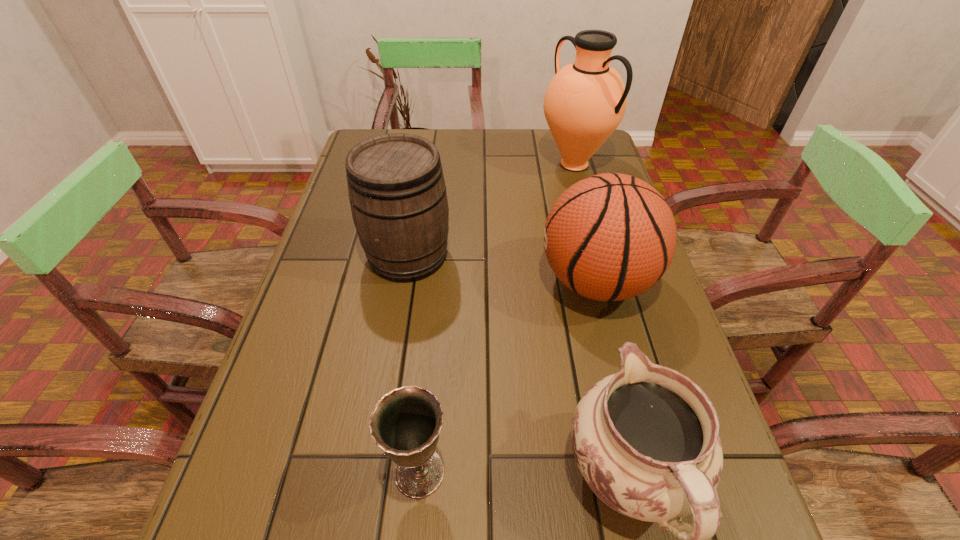
Where is `vacant area situated 0.160m on the back of the chalice`? The width and height of the screenshot is (960, 540). vacant area situated 0.160m on the back of the chalice is located at coordinates (430, 361).

I want to click on object present at the far edge, so click(x=584, y=103).

Locate an element on the screen. Image resolution: width=960 pixels, height=540 pixels. object that is at the left edge is located at coordinates (396, 187).

The image size is (960, 540). I want to click on pitcher that is positioned at the right edge, so click(584, 103).

Where is `basketball present at the right edge`? basketball present at the right edge is located at coordinates (609, 237).

Image resolution: width=960 pixels, height=540 pixels. I want to click on object situated at the far right corner, so click(x=584, y=103).

Image resolution: width=960 pixels, height=540 pixels. In the image, there is a desktop. Find the location of `vacant region at the far edge`. vacant region at the far edge is located at coordinates (511, 145).

This screenshot has width=960, height=540. In the image, there is a desktop. Identify the location of free space at the left edge. tap(333, 289).

Image resolution: width=960 pixels, height=540 pixels. I want to click on free space at the right edge, so click(590, 307).

The image size is (960, 540). Identify the location of free point at the far right corner. (602, 148).